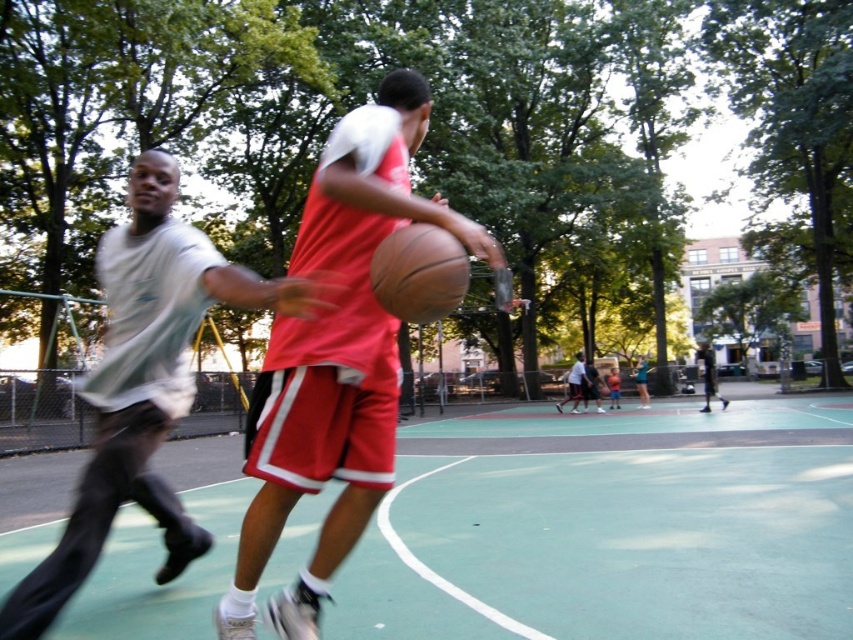
Between green rubber basketball court at center and matte black basketball at center, which one has more height?

Standing taller between the two is matte black basketball at center.

Between point (666, 497) and point (711, 369), which one is positioned in front?

Point (666, 497)

You are a GUI agent. You are given a task and a screenshot of the screen. Output one action in this format:
    pyautogui.click(x=<x>, y=<y>)
    Task: Click on the green rubber basketball court at center
    
    Given the screenshot: What is the action you would take?
    pyautogui.click(x=611, y=528)

Which is below, white cotton t-shirt at left or matte black basketball at center?

matte black basketball at center

Does point (167, 193) come behind point (711, 388)?

No, it is in front of (711, 388).

Identify the location of white cotton t-shirt at left. This screenshot has height=640, width=853. (144, 381).

Is green rubber basketball court at center above rubber textured basketball at center?

Incorrect, green rubber basketball court at center is not positioned above rubber textured basketball at center.

Which of these two, green rubber basketball court at center or rubber textured basketball at center, stands shorter?

rubber textured basketball at center

The height and width of the screenshot is (640, 853). I want to click on green rubber basketball court at center, so click(611, 528).

Image resolution: width=853 pixels, height=640 pixels. Find the location of `green rubber basketball court at center`. green rubber basketball court at center is located at coordinates pos(611,528).